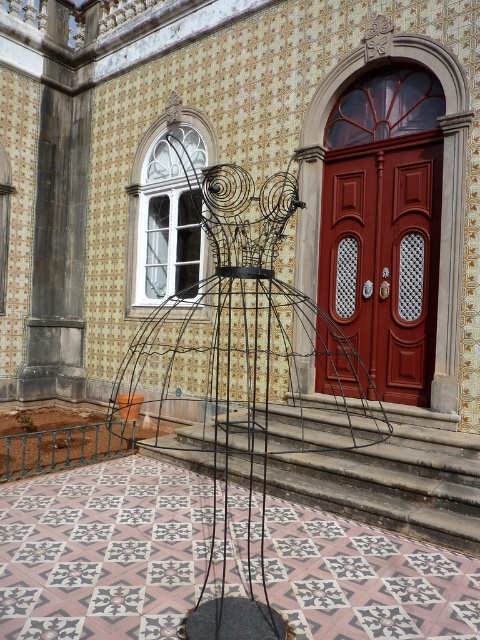
Between black wire sculpture at center and matte red door at center, which one has less height?

black wire sculpture at center

Which is below, black wire sculpture at center or matte red door at center?

black wire sculpture at center is below.

Find the location of a particular element. The image size is (480, 640). black wire sculpture at center is located at coordinates (241, 365).

Locate an element on the screen. The width and height of the screenshot is (480, 640). black wire sculpture at center is located at coordinates (241, 365).